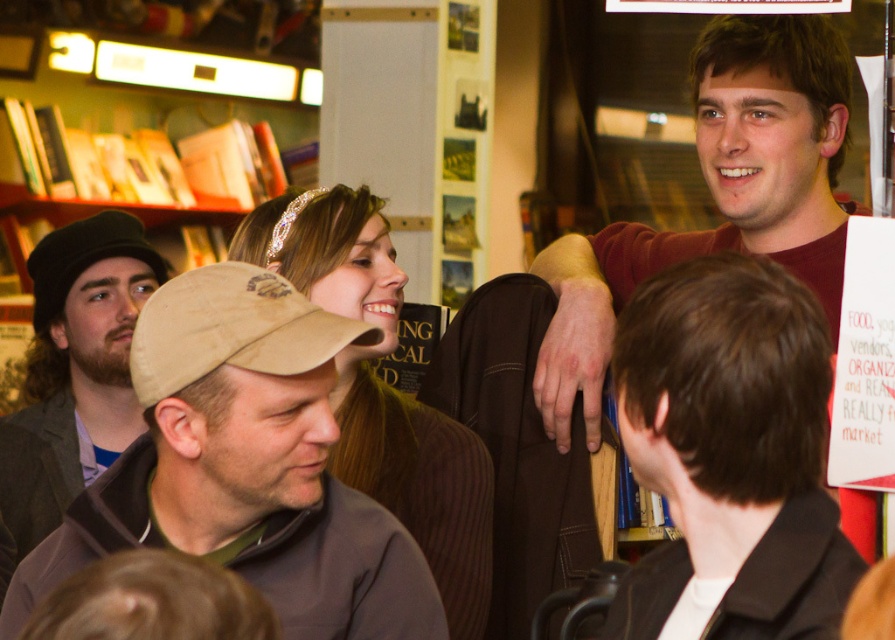
Question: Which of these objects is positioned closest to the brown woolen cap at left?

Choices:
 (A) brown fleece cap at center
 (B) shiny silver headband at upper center
 (C) black matte jacket at upper right
 (D) tan fabric baseball cap at center

Answer: (B)

Question: Can you confirm if brown woolen cap at left is positioned to the left of tan fabric baseball cap at center?

Choices:
 (A) yes
 (B) no

Answer: (A)

Question: Can you confirm if matte brown shirt at upper right is positioned to the right of brown woolen cap at left?

Choices:
 (A) no
 (B) yes

Answer: (B)

Question: Which object is farther from the camera taking this photo?

Choices:
 (A) brown woolen cap at left
 (B) shiny silver headband at upper center

Answer: (A)

Question: Which object appears farthest from the camera in this image?

Choices:
 (A) brown fleece cap at center
 (B) brown woolen cap at left
 (C) matte brown shirt at upper right

Answer: (C)

Question: Does brown fleece cap at center appear over shiny silver headband at upper center?

Choices:
 (A) no
 (B) yes

Answer: (A)